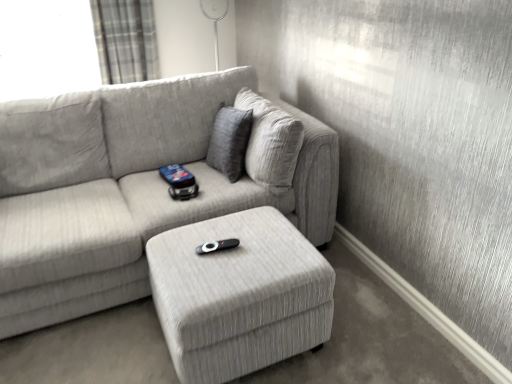
You are a GUI agent. You are given a task and a screenshot of the screen. Output one action in this format:
    pyautogui.click(x=<x>, y=<y>)
    Task: Click on the vacant space to the right of black plastic remote at center
    This screenshot has width=512, height=384.
    Given the screenshot: What is the action you would take?
    pyautogui.click(x=266, y=246)